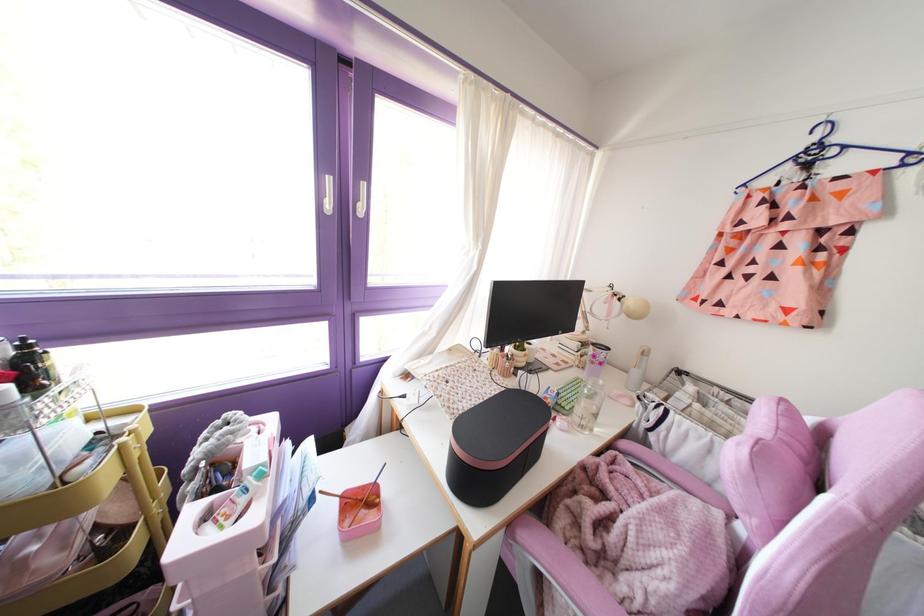
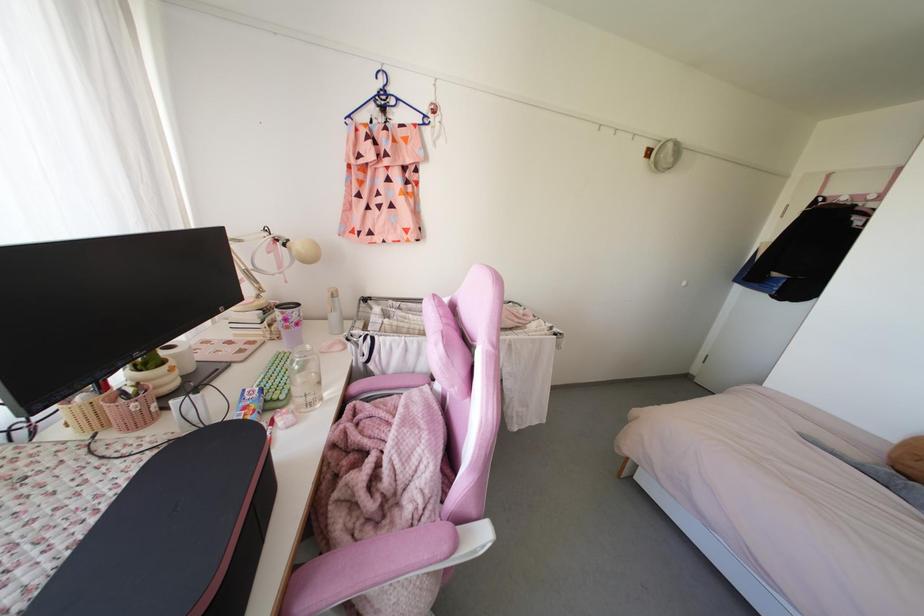
First-person continuous shooting, in which direction is the camera rotating?

The camera's rotation is toward right-down.